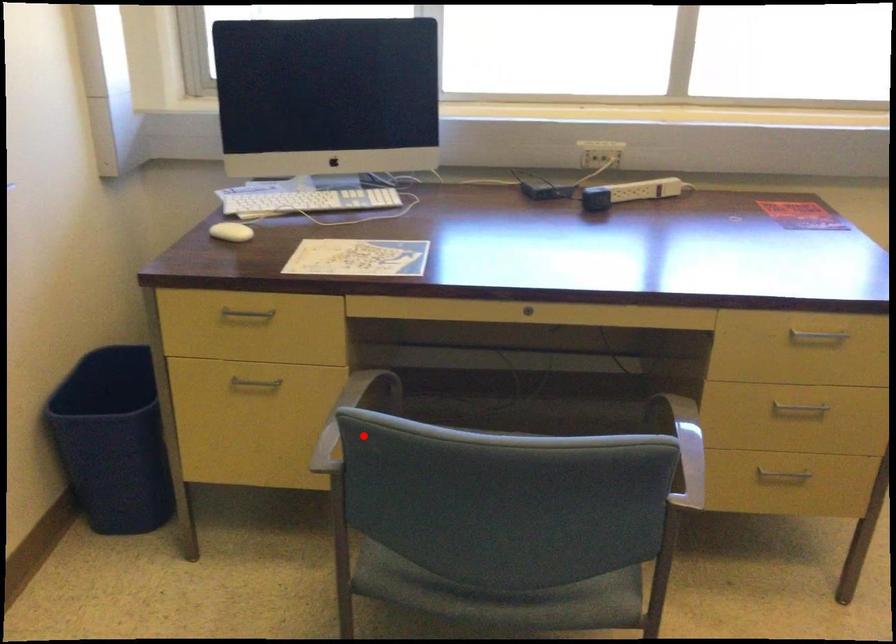
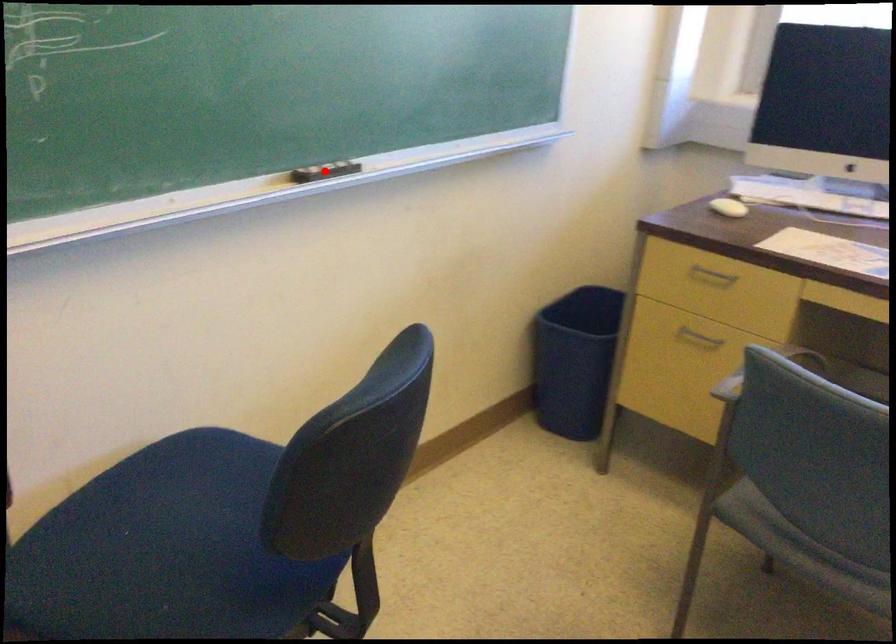
I am providing you with two images of the same scene from different viewpoints. A red point is marked on the first image and another point is marked on the second image. Is the red point in image1 aligned with the point shown in image2?

No